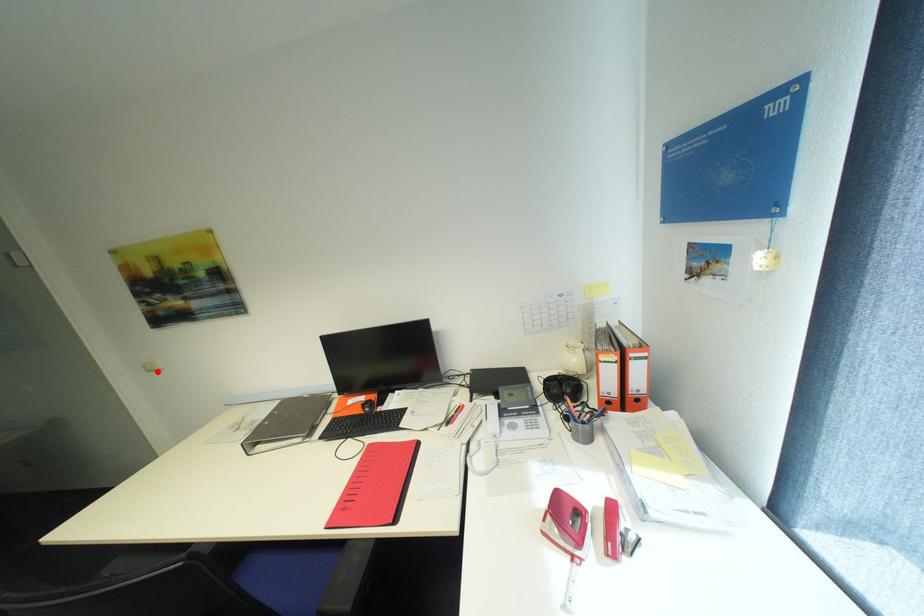
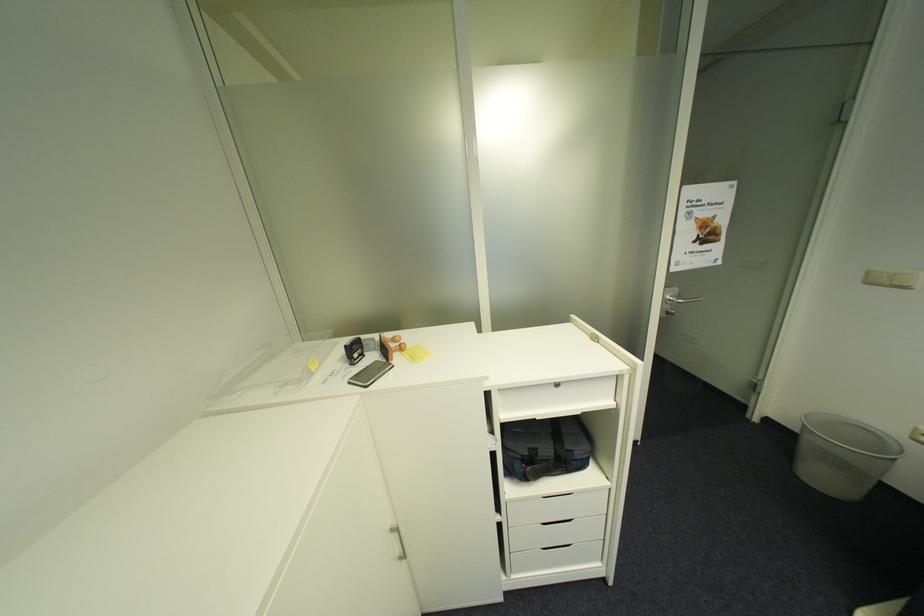
Locate, in the second image, the point that corresponds to the highlighted location in the first image.

(876, 284)